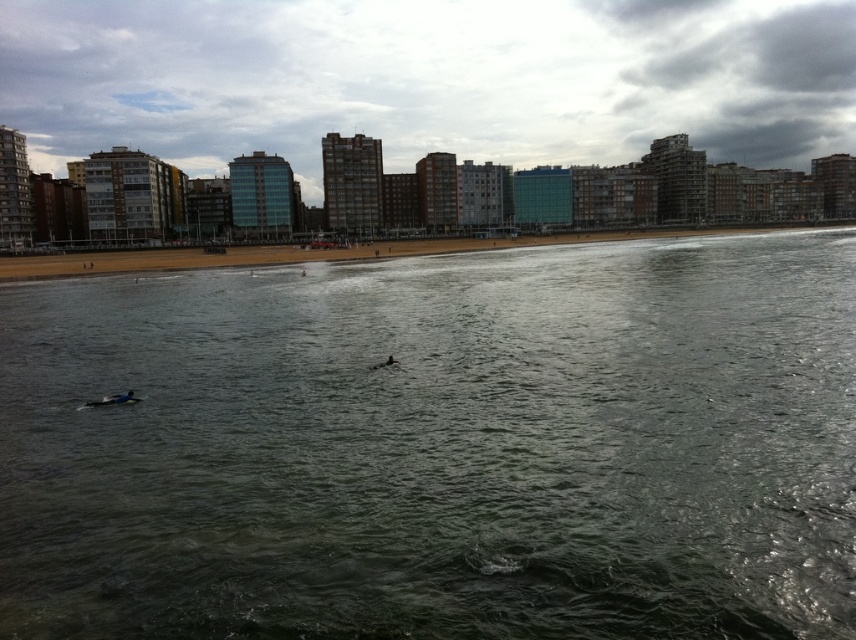
Who is more forward, (785, 272) or (396, 243)?

Answer: Positioned in front is point (785, 272).

Which is more to the right, dark green water at center or brown sand at lower center?

brown sand at lower center is more to the right.

Where is `dark green water at center`? This screenshot has height=640, width=856. dark green water at center is located at coordinates (438, 445).